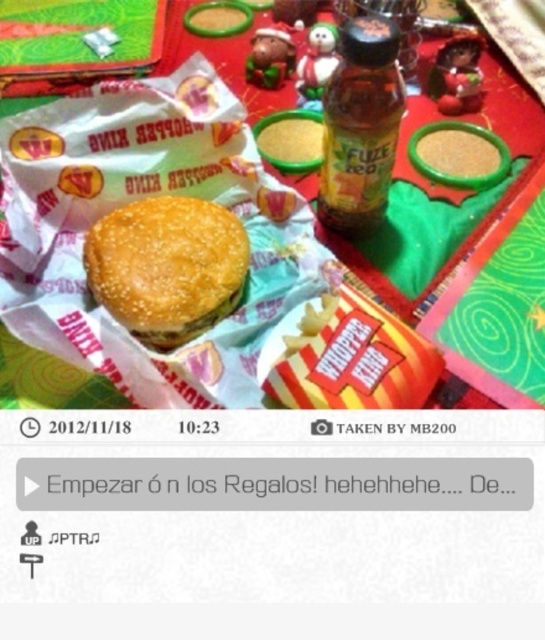
Does green matte tray at center appear on the right side of translucent plastic bottle at center?

Indeed, green matte tray at center is positioned on the right side of translucent plastic bottle at center.

Measure the distance between point [74,291] and camera.

They are 18.90 inches apart.

The image size is (545, 640). I want to click on green matte tray at center, so click(x=175, y=196).

The image size is (545, 640). Describe the element at coordinates (166, 266) in the screenshot. I see `sesame seed bun at center` at that location.

Is sesame seed bun at center wider than translucent plastic bottle at center?

Correct, the width of sesame seed bun at center exceeds that of translucent plastic bottle at center.

This screenshot has width=545, height=640. Describe the element at coordinates (166, 266) in the screenshot. I see `sesame seed bun at center` at that location.

Where is `sesame seed bun at center`? sesame seed bun at center is located at coordinates (166, 266).

Does green matte tray at center appear over sesame seed bun at center?

Indeed, green matte tray at center is positioned over sesame seed bun at center.

Does point (293, 344) come closer to viewer compared to point (201, 288)?

Yes, it is.

Is point (136, 145) farther from viewer compared to point (142, 246)?

Yes, point (136, 145) is behind point (142, 246).

At what (x,y) coordinates should I click in order to perform the action: click on green matte tray at center. Please return your answer as a coordinate pair (x, y). The image size is (545, 640). Looking at the image, I should click on (175, 196).